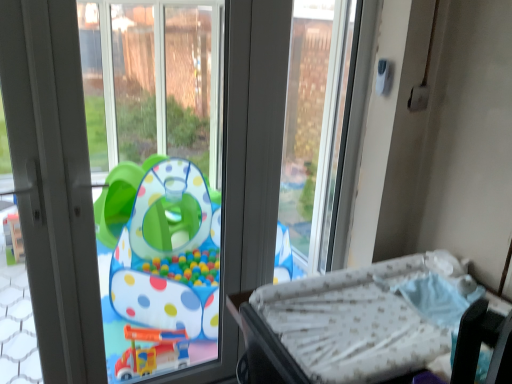
Question: Which direction should I rotate to look at transparent plastic playpen at center, arranged as the second window screen when viewed from the right, — up or down?

Choices:
 (A) down
 (B) up

Answer: (A)

Question: Can transparent plastic playpen at center, placed as the 1th window screen when sorted from left to right, be found inside white dotted mattress at lower right?

Choices:
 (A) yes
 (B) no

Answer: (B)

Question: From the image's perspective, is white dotted mattress at lower right below transparent plastic playpen at center, arranged as the second window screen when viewed from the right?

Choices:
 (A) yes
 (B) no

Answer: (A)

Question: Can you confirm if white dotted mattress at lower right is shorter than transparent plastic playpen at center, placed as the 1th window screen when sorted from left to right?

Choices:
 (A) no
 (B) yes

Answer: (B)

Question: Is white dotted mattress at lower right in contact with transparent plastic playpen at center, arranged as the second window screen when viewed from the right?

Choices:
 (A) no
 (B) yes

Answer: (A)

Question: From a real-world perspective, is white dotted mattress at lower right over transparent plastic playpen at center, arranged as the second window screen when viewed from the right?

Choices:
 (A) no
 (B) yes

Answer: (A)

Question: Considering the relative sizes of white dotted mattress at lower right and transparent plastic playpen at center, arranged as the second window screen when viewed from the right, in the image provided, is white dotted mattress at lower right thinner than transparent plastic playpen at center, arranged as the second window screen when viewed from the right,?

Choices:
 (A) no
 (B) yes

Answer: (A)

Question: Does white plastic screen door at left come behind transparent plastic window screen at upper center, which is the second window screen from left to right?

Choices:
 (A) yes
 (B) no

Answer: (B)

Question: Does white plastic screen door at left have a greater height compared to transparent plastic window screen at upper center, marked as the 1th window screen in a right-to-left arrangement?

Choices:
 (A) yes
 (B) no

Answer: (A)

Question: Can you confirm if white plastic screen door at left is positioned to the right of transparent plastic window screen at upper center, which is the second window screen from left to right?

Choices:
 (A) no
 (B) yes

Answer: (A)

Question: Does white plastic screen door at left have a lesser width compared to transparent plastic window screen at upper center, marked as the 1th window screen in a right-to-left arrangement?

Choices:
 (A) no
 (B) yes

Answer: (A)

Question: Is white plastic screen door at left wider than transparent plastic window screen at upper center, which is the second window screen from left to right?

Choices:
 (A) yes
 (B) no

Answer: (A)

Question: From a real-world perspective, is white plastic screen door at left located beneath transparent plastic window screen at upper center, marked as the 1th window screen in a right-to-left arrangement?

Choices:
 (A) no
 (B) yes

Answer: (B)